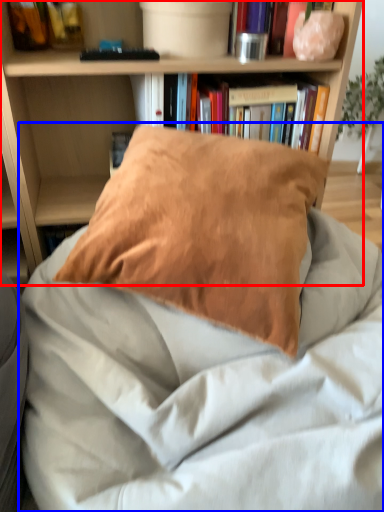
Question: Among these objects, which one is nearest to the camera, bookcase (highlighted by a red box) or bed (highlighted by a blue box)?

Choices:
 (A) bookcase
 (B) bed

Answer: (B)